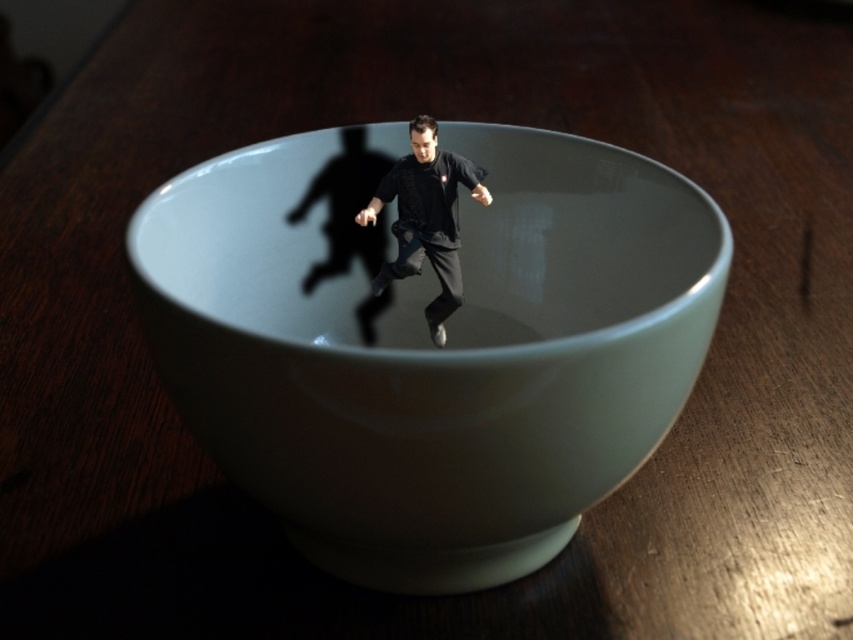
Is the position of white glossy bowl at center more distant than that of black matte shirt at center?

No, it is not.

Who is higher up, white glossy bowl at center or black matte shirt at center?

Positioned higher is black matte shirt at center.

The height and width of the screenshot is (640, 853). Describe the element at coordinates (428, 342) in the screenshot. I see `white glossy bowl at center` at that location.

Identify the location of white glossy bowl at center. This screenshot has height=640, width=853. (428, 342).